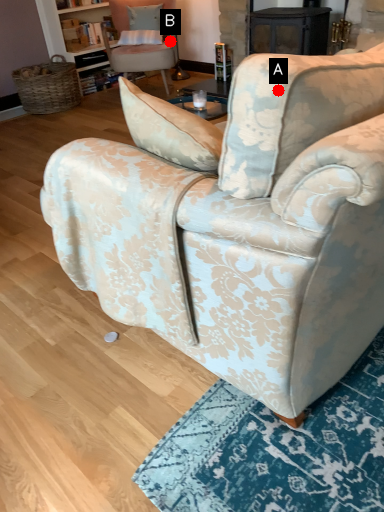
Question: Two points are circled on the image, labeled by A and B beside each circle. Which point appears closest to the camera in this image?

Choices:
 (A) A is closer
 (B) B is closer

Answer: (A)